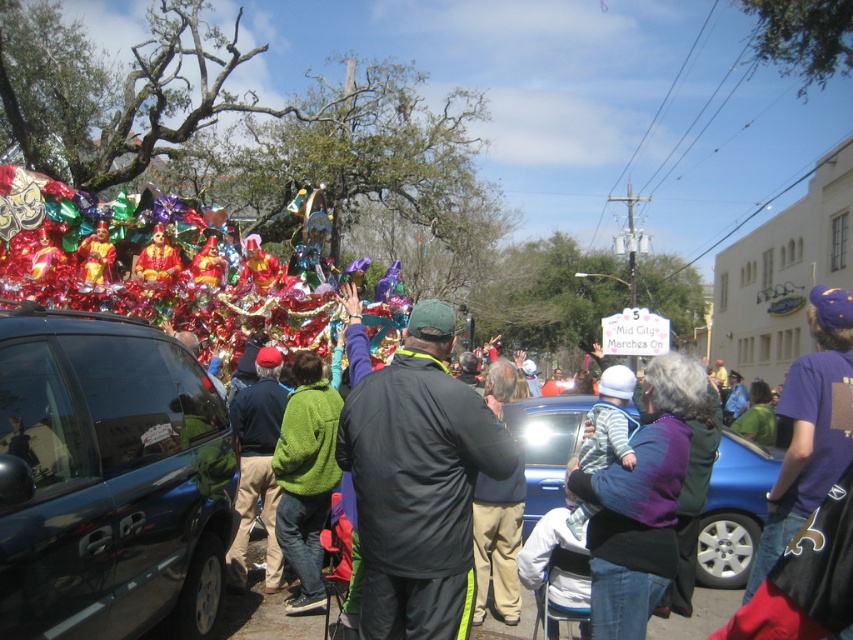
Question: Which object appears farthest from the camera in this image?

Choices:
 (A) purple cotton shirt at right
 (B) glossy dark blue van at left
 (C) black fabric jacket at center

Answer: (A)

Question: Which object is the closest to the purple cotton shirt at right?

Choices:
 (A) blue metallic car at center
 (B) black fabric jacket at center
 (C) green fuzzy sweater at center
 (D) glossy dark blue van at left

Answer: (A)

Question: Is blue metallic car at center above green fuzzy sweater at center?

Choices:
 (A) no
 (B) yes

Answer: (A)

Question: Which object is positioned farthest from the blue metallic car at center?

Choices:
 (A) glossy dark blue van at left
 (B) green fuzzy sweater at center
 (C) purple cotton shirt at right

Answer: (A)

Question: Does black fabric jacket at center have a greater width compared to green fuzzy sweater at center?

Choices:
 (A) no
 (B) yes

Answer: (B)

Question: From the image, what is the correct spatial relationship of purple cotton shirt at right in relation to green fuzzy sweater at center?

Choices:
 (A) above
 (B) below

Answer: (A)